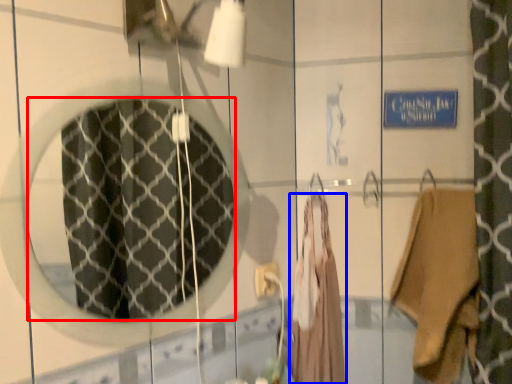
Question: Which object is closer to the camera taking this photo, mirror (highlighted by a red box) or clothing (highlighted by a blue box)?

Choices:
 (A) mirror
 (B) clothing

Answer: (A)